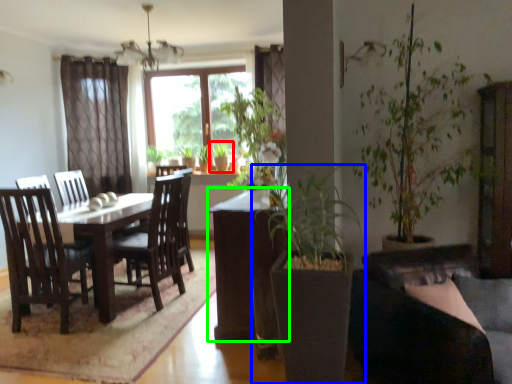
Question: Considering the real-world distances, which object is closest to houseplant (highlighted by a red box)? houseplant (highlighted by a blue box) or table (highlighted by a green box).

Choices:
 (A) houseplant
 (B) table

Answer: (B)